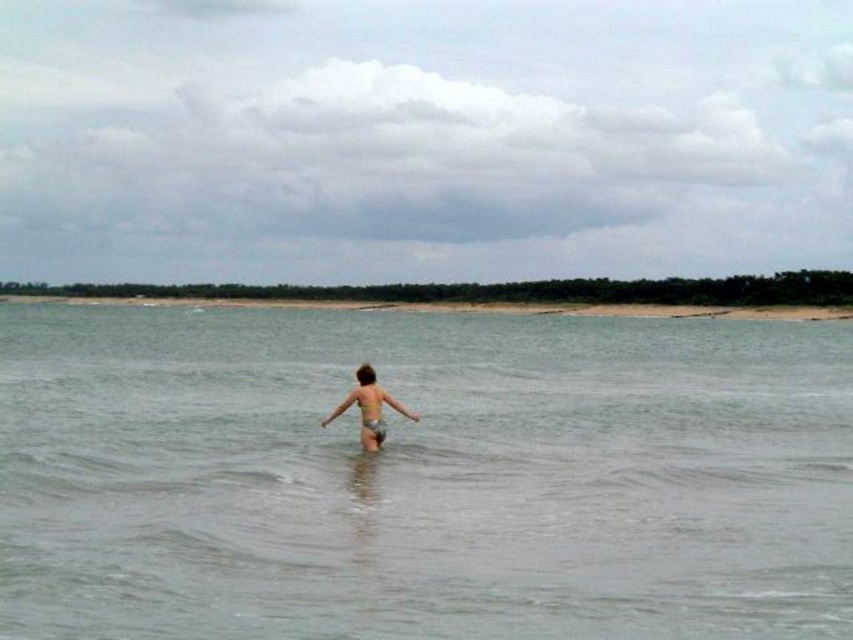
Does clear water at center appear on the left side of light brown skin at center?

Correct, you'll find clear water at center to the left of light brown skin at center.

Where is `clear water at center`? clear water at center is located at coordinates (421, 476).